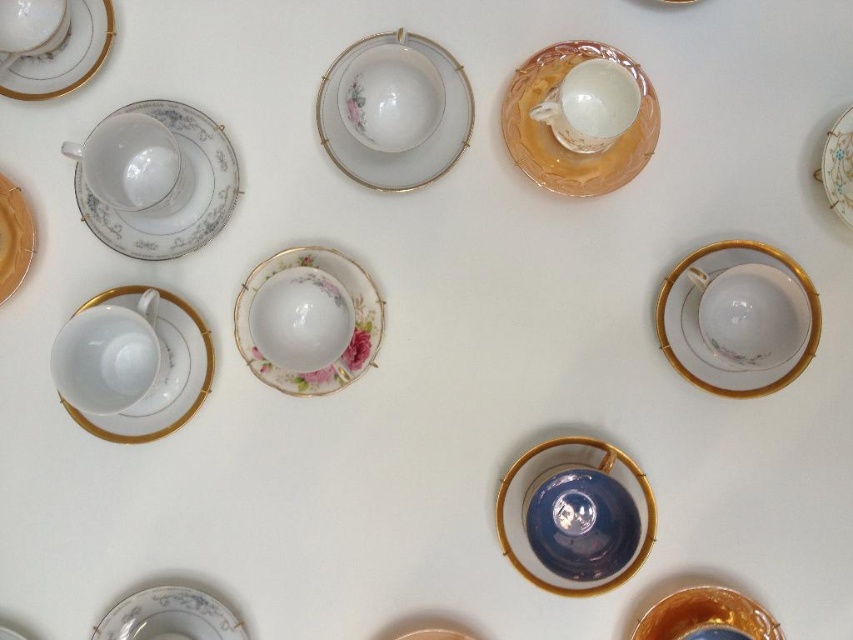
Is porcelain cup at upper right thinner than matte gold plate at left?

No.

Is point (585, 80) positioned before point (9, 241)?

Yes, it is.

Between point (561, 134) and point (10, 202), which one is positioned behind?

Point (561, 134)

This screenshot has width=853, height=640. What are the coordinates of `porcelain cup at upper right` in the screenshot? It's located at (590, 106).

Can you confirm if porcelain floral saucer at left is bigger than matte porcelain teacup at upper left?

Yes.

Looking at this image, who is positioned more to the left, porcelain floral saucer at left or matte porcelain teacup at upper left?

matte porcelain teacup at upper left is more to the left.

Find the location of a particular element. Image resolution: width=853 pixels, height=640 pixels. porcelain floral saucer at left is located at coordinates (173, 189).

Is porcelain cup at center taller than porcelain plate at bottom left?

Correct, porcelain cup at center is much taller as porcelain plate at bottom left.

Is porcelain cup at center positioned in front of porcelain plate at bottom left?

No, porcelain cup at center is behind porcelain plate at bottom left.

Between point (416, 129) and point (102, 632), which one is positioned behind?

Point (416, 129)

The height and width of the screenshot is (640, 853). What are the coordinates of `porcelain cup at center` in the screenshot? It's located at (390, 97).